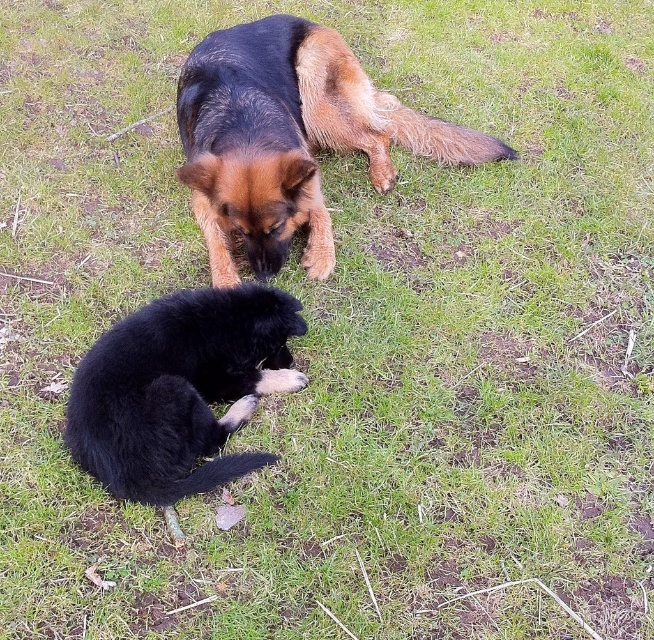
Question: Can you confirm if brown-furred dog at upper center is positioned to the right of black fluffy dog at lower left?

Choices:
 (A) yes
 (B) no

Answer: (A)

Question: Does brown-furred dog at upper center appear under black fluffy dog at lower left?

Choices:
 (A) yes
 (B) no

Answer: (B)

Question: Which of the following is the farthest from the observer?

Choices:
 (A) (205, 124)
 (B) (131, 346)

Answer: (A)

Question: Among these points, which one is farthest from the camera?

Choices:
 (A) (75, 404)
 (B) (216, 86)

Answer: (B)

Question: Does brown-furred dog at upper center have a lesser width compared to black fluffy dog at lower left?

Choices:
 (A) yes
 (B) no

Answer: (B)